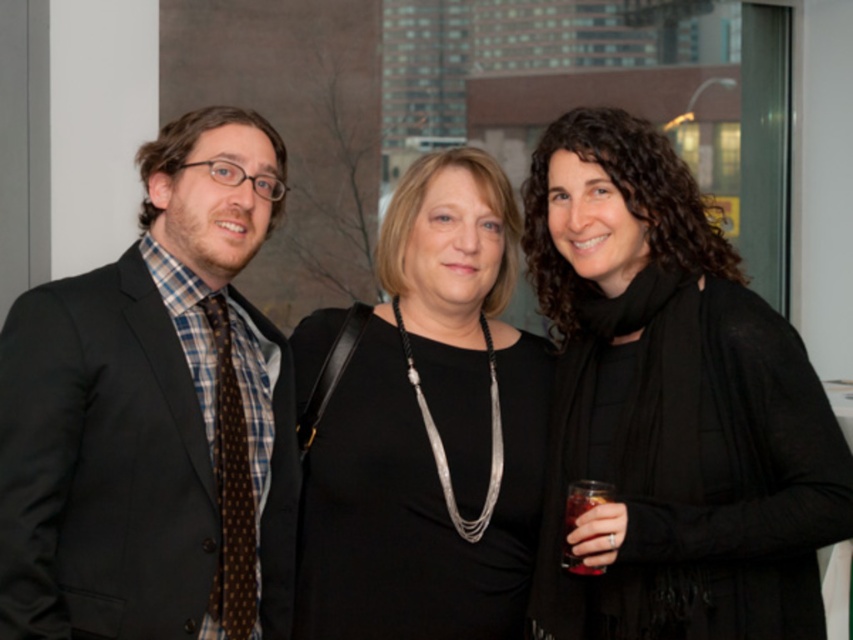
You are standing in front of the image and want to know the position of the matte black suit at left relative to the translucent glass at right. Can you determine which object is positioned to the left of the other?

The matte black suit at left is positioned to the left of the translucent glass at right according to the description.

You are organizing a charity event and need to place a large donation box next to the objects in the scene. Given that the donation box is the same size as the translucent glass at right, will it fit next to the matte black suit at left without overlapping?

The matte black suit at left is bigger than the translucent glass at right. Since the donation box is the same size as the translucent glass, it should fit next to the matte black suit without overlapping, as there is enough space around the larger suit to accommodate the smaller box.

You are at a party and want to compliment the woman wearing the black sheer scarf at center and the man in the matte black suit at left. Which one is positioned closer to the right side of the group photo?

The black sheer scarf at center is to the right of the matte black suit at left, so the woman wearing the black sheer scarf at center is positioned closer to the right side of the group photo.